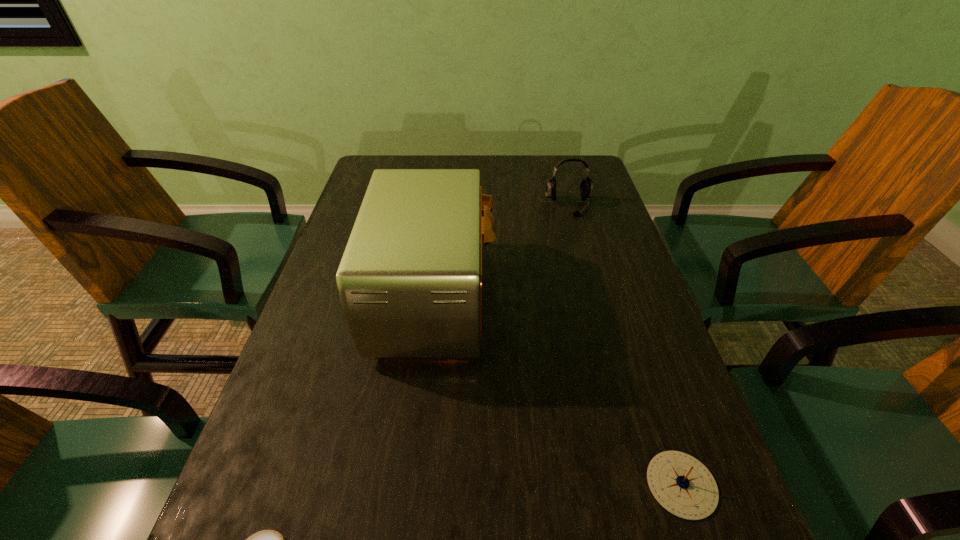
Where is `vacant region that satisfies the following two spatial constraints: 1. on the door side of the taller compass; 2. on the left side of the toaster oven`? This screenshot has width=960, height=540. vacant region that satisfies the following two spatial constraints: 1. on the door side of the taller compass; 2. on the left side of the toaster oven is located at coordinates tap(416, 484).

The height and width of the screenshot is (540, 960). Find the location of `free space that satisfies the following two spatial constraints: 1. with the microphone on the side of the farthest object; 2. on the door side of the toaster oven`. free space that satisfies the following two spatial constraints: 1. with the microphone on the side of the farthest object; 2. on the door side of the toaster oven is located at coordinates pyautogui.click(x=593, y=297).

Find the location of `free spot that satisfies the following two spatial constraints: 1. with the microphone on the side of the second nearest object; 2. on the right side of the farthest object`. free spot that satisfies the following two spatial constraints: 1. with the microphone on the side of the second nearest object; 2. on the right side of the farthest object is located at coordinates tap(644, 484).